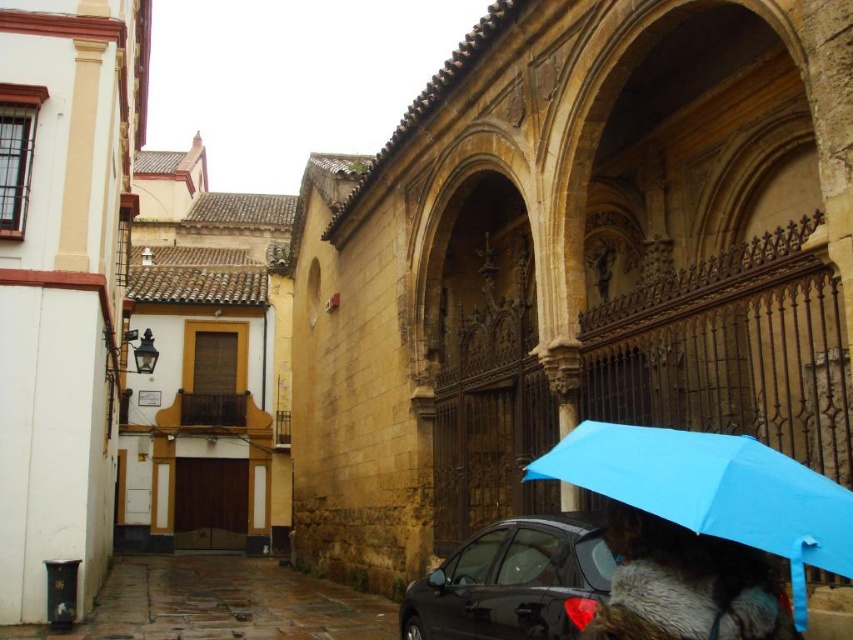
Based on the photo, you are standing at the camera position in the historic European town scene. There are two points marked on the image. The first point is at coordinates point (782, 524) and the second point is at point (614, 612). Which point is closer to you?

Point (782, 524) is closer to the camera than point (614, 612).

You are a tourist standing on the narrow street in the historic town. You see a blue matte umbrella at lower right and a fur coat at lower right. Which object is closer to the right edge of the street?

The fur coat at lower right is closer to the right edge of the street because the blue matte umbrella at lower right is to the left of it.

You are a tourist standing on the street looking at the historic building. You see a glossy black car at lower center and a fur coat at lower right. Which object is closer to the ground?

The glossy black car at lower center is closer to the ground because it is located below the fur coat at lower right.